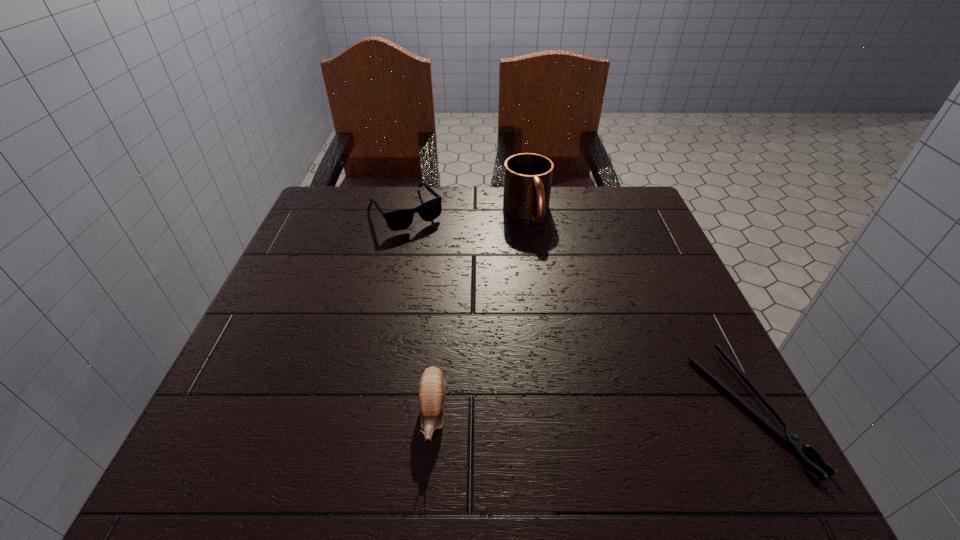
Find the location of a particular element. This screenshot has width=960, height=540. escargot is located at coordinates (432, 388).

The width and height of the screenshot is (960, 540). Find the location of `tongs`. tongs is located at coordinates (791, 437).

Locate an element on the screen. the rightmost object is located at coordinates (791, 437).

Where is `sunglasses`? This screenshot has height=540, width=960. sunglasses is located at coordinates (397, 220).

At what (x,y) coordinates should I click in order to perform the action: click on mug. Please return your answer as a coordinate pair (x, y). The width and height of the screenshot is (960, 540). Looking at the image, I should click on (527, 176).

Find the location of a particular element. The width and height of the screenshot is (960, 540). the tallest object is located at coordinates (527, 176).

You are a GUI agent. You are given a task and a screenshot of the screen. Output one action in this format:
    pyautogui.click(x=<x>, y=<y>)
    Task: Click on the vacant region located on the left of the tongs
    The height and width of the screenshot is (540, 960).
    Given the screenshot: What is the action you would take?
    pyautogui.click(x=491, y=408)

This screenshot has width=960, height=540. Find the location of `vacant space located on the front-facing side of the sunglasses`. vacant space located on the front-facing side of the sunglasses is located at coordinates (499, 324).

The height and width of the screenshot is (540, 960). I want to click on free space located 0.220m on the front-facing side of the sunglasses, so click(x=463, y=281).

What are the coordinates of `free space located on the front-facing side of the sunglasses` in the screenshot? It's located at click(x=434, y=246).